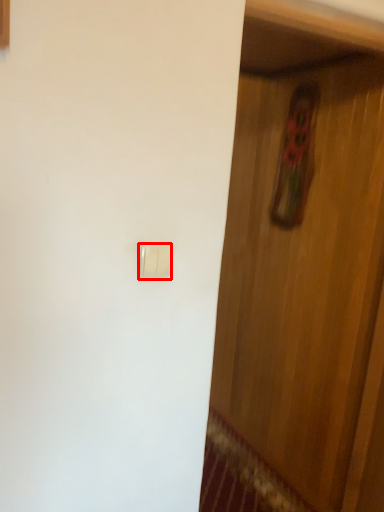
Question: In this image, where is light switch (annotated by the red box) located relative to door?

Choices:
 (A) left
 (B) right

Answer: (A)